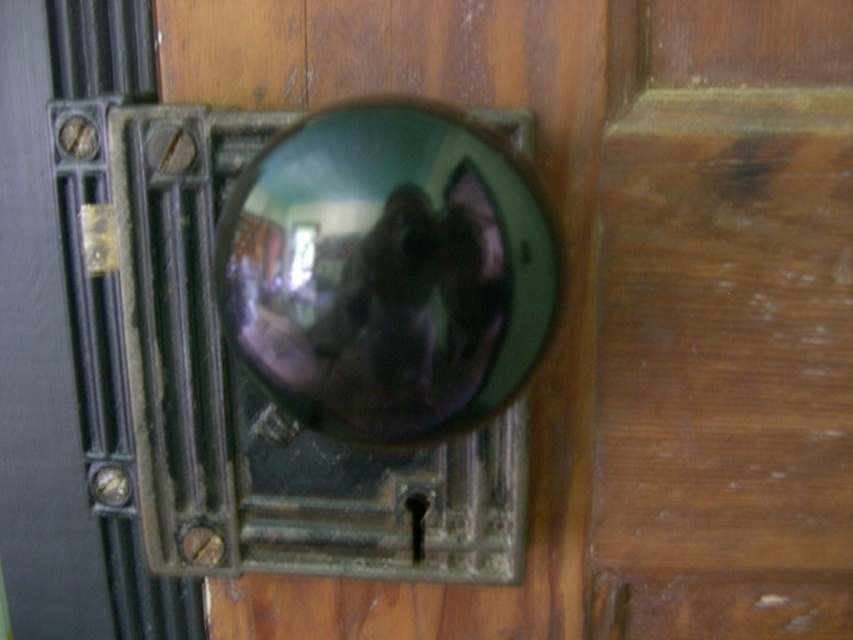
Question: Can you confirm if shiny green knob at center is positioned to the left of glossy metallic sphere at center?

Choices:
 (A) yes
 (B) no

Answer: (A)

Question: In this image, where is shiny green knob at center located relative to glossy metallic sphere at center?

Choices:
 (A) left
 (B) right

Answer: (A)

Question: Which object appears closest to the camera in this image?

Choices:
 (A) shiny green knob at center
 (B) glossy metallic sphere at center

Answer: (B)

Question: Is shiny green knob at center thinner than glossy metallic sphere at center?

Choices:
 (A) yes
 (B) no

Answer: (B)